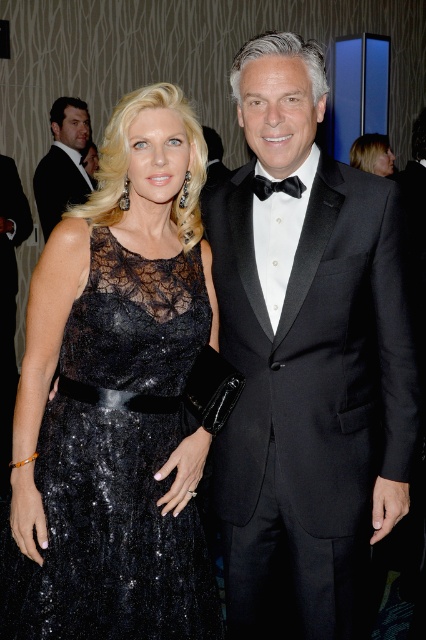
Question: Which object appears closest to the camera in this image?

Choices:
 (A) matte black tuxedo at upper left
 (B) black sequined dress at center

Answer: (B)

Question: Can you confirm if black satin tuxedo at center is smaller than matte black tuxedo at upper left?

Choices:
 (A) no
 (B) yes

Answer: (A)

Question: Which object is the closest to the black satin tuxedo at center?

Choices:
 (A) black satin bow tie at center
 (B) satin black dress at upper center

Answer: (A)

Question: Among these points, which one is farthest from the camera?

Choices:
 (A) (363, 301)
 (B) (267, 182)

Answer: (A)

Question: Can you confirm if black satin tuxedo at center is positioned below satin black dress at upper center?

Choices:
 (A) yes
 (B) no

Answer: (A)

Question: Can you confirm if black sequined dress at center is bigger than matte black tuxedo at upper left?

Choices:
 (A) no
 (B) yes

Answer: (A)